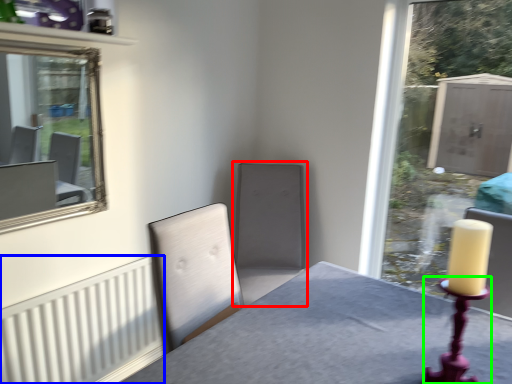
Question: Based on their relative distances, which object is farther from swivel chair (highlighted by a red box)? Choose from radiator (highlighted by a blue box) and candle holder (highlighted by a green box).

Choices:
 (A) radiator
 (B) candle holder

Answer: (B)